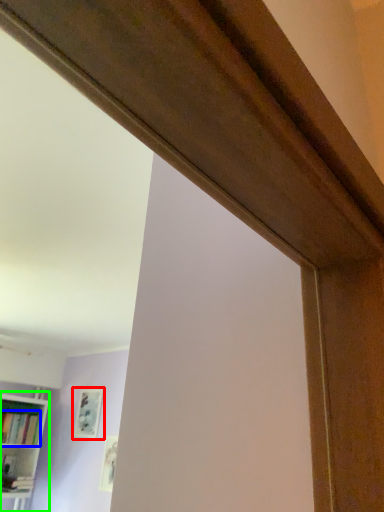
Question: Considering the real-world distances, which object is closest to picture frame (highlighted by a red box)? book (highlighted by a blue box) or bookcase (highlighted by a green box).

Choices:
 (A) book
 (B) bookcase

Answer: (A)